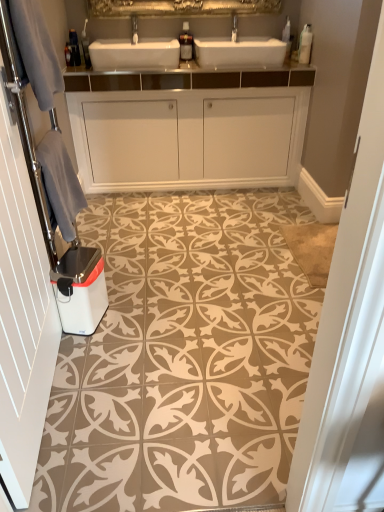
This screenshot has height=512, width=384. What are the coordinates of `free point behind white textured towel at left` in the screenshot? It's located at (106, 342).